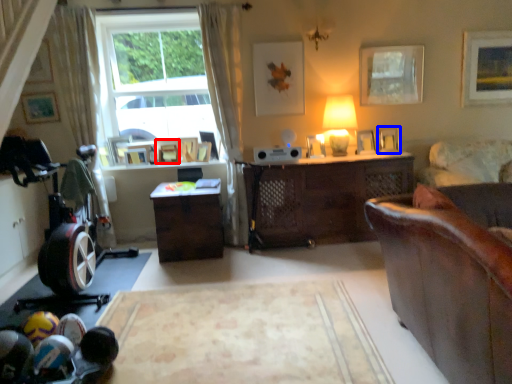
Question: Which of the following is the closest to the observer, picture frame (highlighted by a red box) or picture frame (highlighted by a blue box)?

Choices:
 (A) picture frame
 (B) picture frame

Answer: (B)